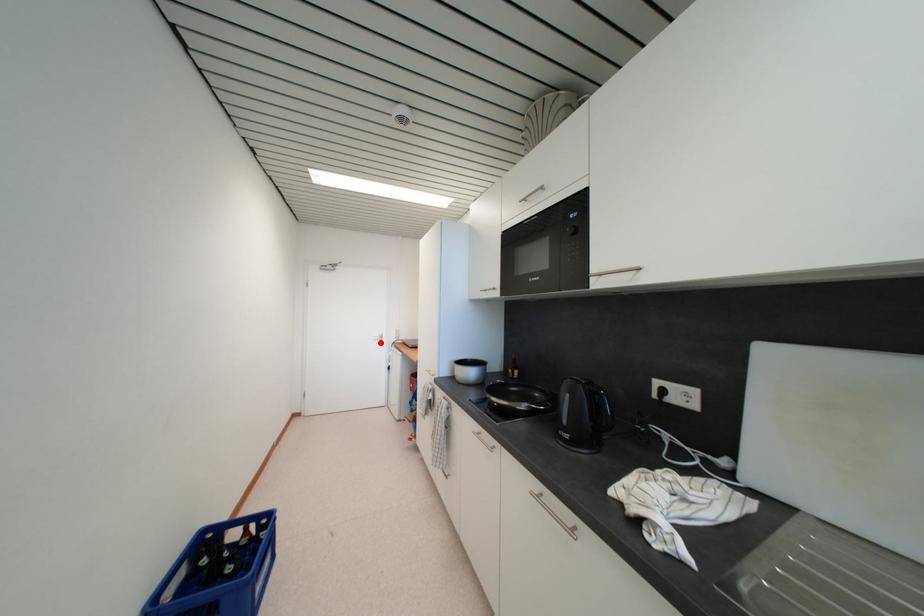
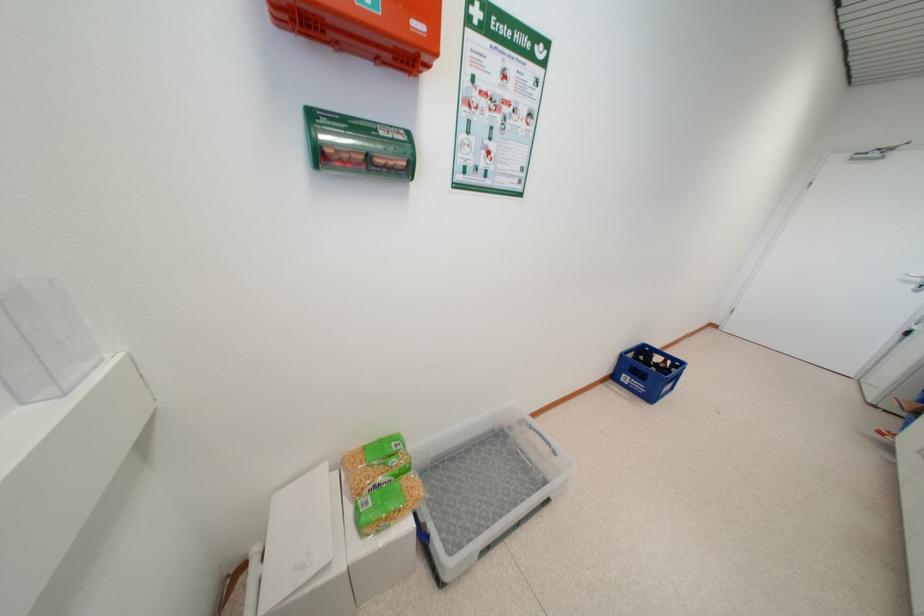
Where in the second image is the point corresponding to the highlighted location from the first image?

(912, 284)